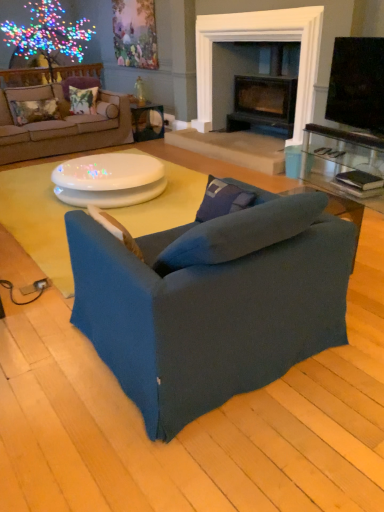
Question: Can you confirm if floral fabric pillow at upper left, arranged as the fourth pillow when ordered from the bottom, is shorter than black glossy tv at upper right?

Choices:
 (A) yes
 (B) no

Answer: (A)

Question: Considering the relative sizes of floral fabric pillow at upper left, arranged as the fourth pillow when ordered from the bottom, and black glossy tv at upper right in the image provided, is floral fabric pillow at upper left, arranged as the fourth pillow when ordered from the bottom, thinner than black glossy tv at upper right?

Choices:
 (A) yes
 (B) no

Answer: (B)

Question: Is floral fabric pillow at upper left, arranged as the fourth pillow when ordered from the bottom, looking in the opposite direction of black glossy tv at upper right?

Choices:
 (A) no
 (B) yes

Answer: (A)

Question: Considering the relative positions of floral fabric pillow at upper left, arranged as the fourth pillow when ordered from the bottom, and black glossy tv at upper right in the image provided, is floral fabric pillow at upper left, arranged as the fourth pillow when ordered from the bottom, to the right of black glossy tv at upper right from the viewer's perspective?

Choices:
 (A) yes
 (B) no

Answer: (B)

Question: Is floral fabric pillow at upper left, the first pillow viewed from the top, bigger than black glossy tv at upper right?

Choices:
 (A) yes
 (B) no

Answer: (B)

Question: Is black glossy tv at upper right surrounded by floral fabric pillow at upper left, which ranks as the third pillow in right-to-left order?

Choices:
 (A) yes
 (B) no

Answer: (B)

Question: Is matte white table at center, the 2th table positioned from the bottom, far from dark blue fabric studio couch at center, which appears as the first studio couch when viewed from the right?

Choices:
 (A) no
 (B) yes

Answer: (B)

Question: Is dark blue fabric studio couch at center, the 2th studio couch when ordered from left to right, at the back of matte white table at center, arranged as the second table when viewed from the front?

Choices:
 (A) yes
 (B) no

Answer: (B)

Question: From the image's perspective, is matte white table at center, arranged as the 1th table when viewed from the back, located beneath dark blue fabric studio couch at center, the 1th studio couch in the bottom-to-top sequence?

Choices:
 (A) no
 (B) yes

Answer: (A)

Question: Is matte white table at center, which ranks as the 1th table in top-to-bottom order, outside of dark blue fabric studio couch at center, which appears as the first studio couch when viewed from the right?

Choices:
 (A) no
 (B) yes

Answer: (B)

Question: Is matte white table at center, which ranks as the 1th table in top-to-bottom order, at the right side of dark blue fabric studio couch at center, the 1th studio couch in the bottom-to-top sequence?

Choices:
 (A) no
 (B) yes

Answer: (A)

Question: Is matte white table at center, arranged as the 1th table when viewed from the back, with dark blue fabric studio couch at center, which is the 2th studio couch from top to bottom?

Choices:
 (A) yes
 (B) no

Answer: (B)

Question: Are floral fabric pillow at upper left, placed as the first pillow when sorted from back to front, and dark blue fabric studio couch at center, the 1th studio couch in the bottom-to-top sequence, making contact?

Choices:
 (A) yes
 (B) no

Answer: (B)